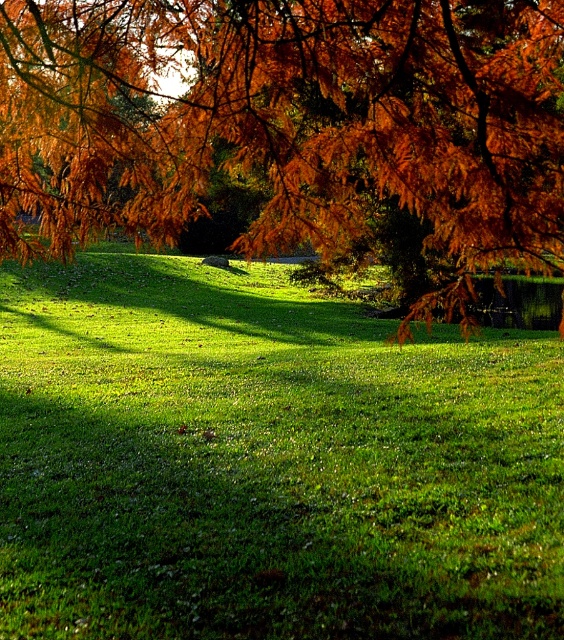
Question: Can you confirm if green grassy at center is bigger than orange leafy branch at upper center?

Choices:
 (A) no
 (B) yes

Answer: (B)

Question: Can you confirm if green grassy at center is wider than orange leafy branch at upper center?

Choices:
 (A) no
 (B) yes

Answer: (B)

Question: Which of the following is the farthest from the observer?

Choices:
 (A) orange leafy branch at upper center
 (B) green grassy at center

Answer: (B)

Question: Which point is farther from the camera taking this photo?

Choices:
 (A) (36, 508)
 (B) (46, 65)

Answer: (A)

Question: Which point is farther to the camera?

Choices:
 (A) (92, 406)
 (B) (63, 24)

Answer: (A)

Question: In this image, where is green grassy at center located relative to orange leafy branch at upper center?

Choices:
 (A) above
 (B) below

Answer: (B)